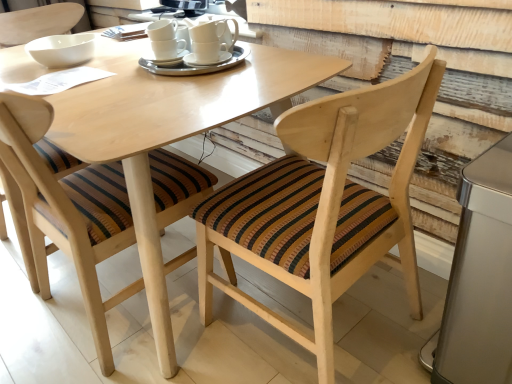
Question: Is white ceramic saucer at center oriented towards silver metallic trash can at lower right?

Choices:
 (A) no
 (B) yes

Answer: (A)

Question: From a real-world perspective, is white ceramic saucer at center on top of silver metallic trash can at lower right?

Choices:
 (A) no
 (B) yes

Answer: (B)

Question: Does white ceramic saucer at center have a lesser height compared to silver metallic trash can at lower right?

Choices:
 (A) yes
 (B) no

Answer: (A)

Question: From a real-world perspective, is white ceramic saucer at center physically below silver metallic trash can at lower right?

Choices:
 (A) no
 (B) yes

Answer: (A)

Question: Is white ceramic saucer at center to the right of silver metallic trash can at lower right from the viewer's perspective?

Choices:
 (A) no
 (B) yes

Answer: (A)

Question: Considering the relative sizes of white ceramic saucer at center and silver metallic trash can at lower right in the image provided, is white ceramic saucer at center bigger than silver metallic trash can at lower right?

Choices:
 (A) no
 (B) yes

Answer: (A)

Question: Does white ceramic cup at center come behind wooden chair with striped cushion at center, which appears as the first chair when viewed from the left?

Choices:
 (A) yes
 (B) no

Answer: (A)

Question: Is wooden chair with striped cushion at center, which appears as the first chair when viewed from the left, inside white ceramic cup at center?

Choices:
 (A) yes
 (B) no

Answer: (B)

Question: Is white ceramic cup at center bigger than wooden chair with striped cushion at center, which appears as the first chair when viewed from the left?

Choices:
 (A) yes
 (B) no

Answer: (B)

Question: Is the depth of white ceramic cup at center less than that of wooden chair with striped cushion at center, the 2th chair from the right?

Choices:
 (A) no
 (B) yes

Answer: (A)

Question: Considering the relative positions of white ceramic cup at center and wooden chair with striped cushion at center, which appears as the first chair when viewed from the left, in the image provided, is white ceramic cup at center to the right of wooden chair with striped cushion at center, which appears as the first chair when viewed from the left, from the viewer's perspective?

Choices:
 (A) no
 (B) yes

Answer: (B)

Question: Is white ceramic cup at center looking in the opposite direction of wooden chair with striped cushion at center, which appears as the first chair when viewed from the left?

Choices:
 (A) no
 (B) yes

Answer: (A)

Question: Is white ceramic saucer at center completely or partially outside of white ceramic cups at center, positioned as the 1th tableware in right-to-left order?

Choices:
 (A) yes
 (B) no

Answer: (B)